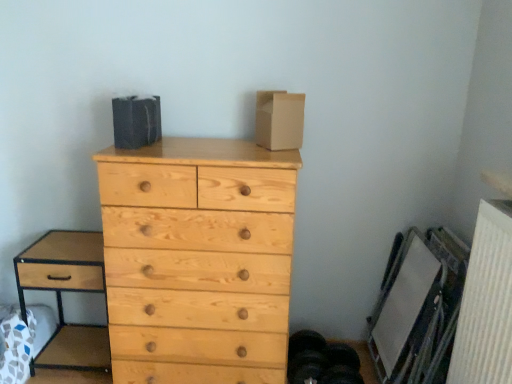
Question: Does point (468, 256) appear closer or farther from the camera than point (96, 233)?

Choices:
 (A) farther
 (B) closer

Answer: (B)

Question: Considering the positions of white textured radiator at lower right and brown wood nightstand at left in the image, is white textured radiator at lower right taller or shorter than brown wood nightstand at left?

Choices:
 (A) tall
 (B) short

Answer: (A)

Question: Which object is the farthest from the brown wood nightstand at left?

Choices:
 (A) brown cardboard box at upper center
 (B) natural wood chest of drawers at center
 (C) white textured radiator at lower right

Answer: (C)

Question: Based on their relative distances, which object is farther from the brown wood nightstand at left?

Choices:
 (A) white textured radiator at lower right
 (B) natural wood chest of drawers at center
 (C) brown cardboard box at upper center

Answer: (A)